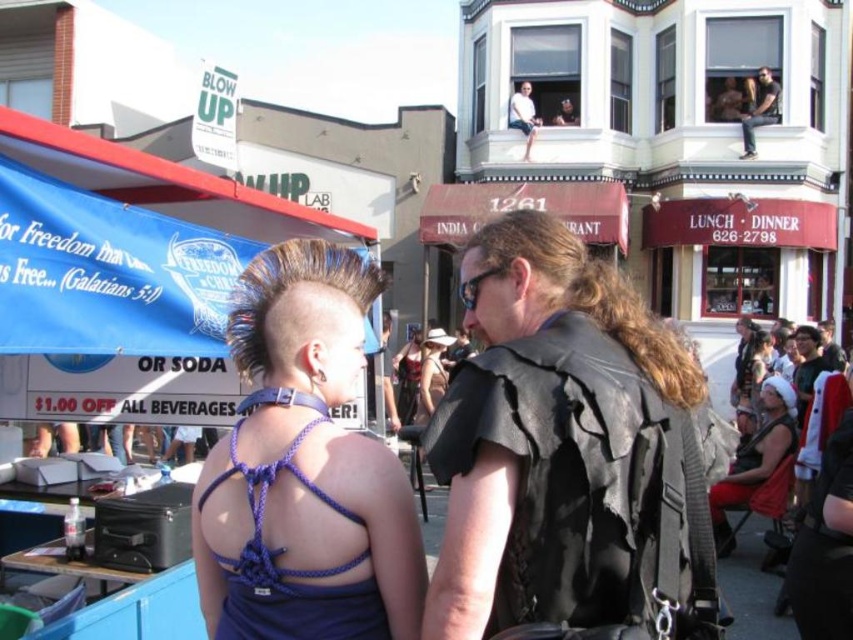
Measure the distance from dark brown leather hair at center to light blue denim shorts at upper center.

A distance of 35.34 feet exists between dark brown leather hair at center and light blue denim shorts at upper center.

Between point (491, 243) and point (529, 86), which one is positioned behind?

Positioned behind is point (529, 86).

Find the location of a particular element. Image resolution: width=853 pixels, height=640 pixels. dark brown leather hair at center is located at coordinates (595, 296).

Does shiny brown mohawk at center have a greater width compared to matte black backpack at center?

In fact, shiny brown mohawk at center might be narrower than matte black backpack at center.

Between shiny brown mohawk at center and matte black backpack at center, which one has less height?

With less height is shiny brown mohawk at center.

Who is more forward, [245,364] or [811,353]?

Point [245,364] is in front.

This screenshot has width=853, height=640. In order to click on shiny brown mohawk at center in this screenshot , I will do `click(289, 288)`.

Does blue rope harness at center appear on the left side of blue fabric canopy at left?

No, blue rope harness at center is not to the left of blue fabric canopy at left.

Is point (412, 566) positioned behind point (184, 272)?

No, it is in front of (184, 272).

The height and width of the screenshot is (640, 853). I want to click on blue rope harness at center, so click(305, 468).